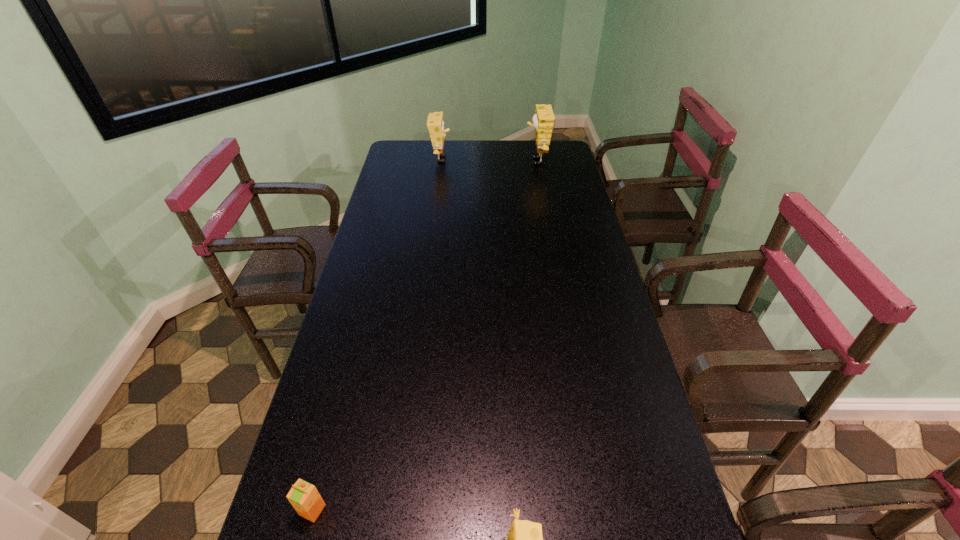
Identify the location of free space between the leftmost sponge and the leftmost object. The image size is (960, 540). (376, 334).

Identify the location of free spot between the tallest object and the orange juice. click(424, 336).

The height and width of the screenshot is (540, 960). In order to click on empty space between the leftmost sponge and the third farthest object in this screenshot , I will do `click(376, 334)`.

The height and width of the screenshot is (540, 960). What are the coordinates of `vacant space that's between the tallest sponge and the shortest object` in the screenshot? It's located at (424, 336).

Identify which object is the nearest to the nearest object. Please provide its 2D coordinates. Your answer should be formatted as a tuple, i.e. [(x, y)], where the tuple contains the x and y coordinates of a point satisfying the conditions above.

[(304, 497)]

Identify which object is the third closest to the rightmost object. Please provide its 2D coordinates. Your answer should be formatted as a tuple, i.e. [(x, y)], where the tuple contains the x and y coordinates of a point satisfying the conditions above.

[(304, 497)]

The image size is (960, 540). Find the location of `sponge that is the closest one to the nearest object`. sponge that is the closest one to the nearest object is located at coordinates (543, 120).

Image resolution: width=960 pixels, height=540 pixels. What are the coordinates of `sponge that stands as the closest to the tallest object` in the screenshot? It's located at (435, 123).

Locate an element on the screen. blank area in the image that satisfies the following two spatial constraints: 1. on the front-facing side of the rightmost sponge; 2. on the front side of the orange juice is located at coordinates (601, 510).